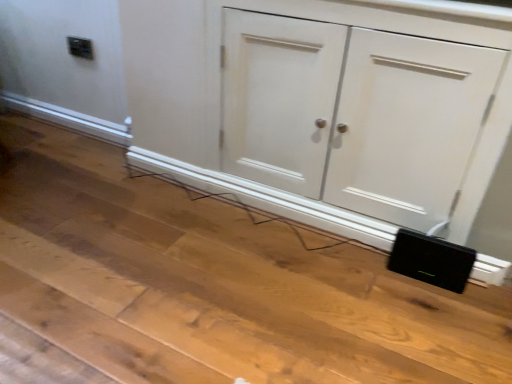
Question: Is white matte cupboard at lower right looking in the opposite direction of black matte speaker at lower right?

Choices:
 (A) yes
 (B) no

Answer: (B)

Question: Considering the relative sizes of white matte cupboard at lower right and black matte speaker at lower right in the image provided, is white matte cupboard at lower right thinner than black matte speaker at lower right?

Choices:
 (A) no
 (B) yes

Answer: (A)

Question: Does white matte cupboard at lower right have a smaller size compared to black matte speaker at lower right?

Choices:
 (A) yes
 (B) no

Answer: (B)

Question: From the image's perspective, is white matte cupboard at lower right on top of black matte speaker at lower right?

Choices:
 (A) no
 (B) yes

Answer: (B)

Question: Considering the relative sizes of white matte cupboard at lower right and black matte speaker at lower right in the image provided, is white matte cupboard at lower right taller than black matte speaker at lower right?

Choices:
 (A) yes
 (B) no

Answer: (A)

Question: From a real-world perspective, relative to black matte speaker at lower right, is white matte cupboard at lower right vertically above or below?

Choices:
 (A) above
 (B) below

Answer: (A)

Question: Based on their positions, is white matte cupboard at lower right located to the left or right of black matte speaker at lower right?

Choices:
 (A) right
 (B) left

Answer: (B)

Question: In terms of width, does white matte cupboard at lower right look wider or thinner when compared to black matte speaker at lower right?

Choices:
 (A) wide
 (B) thin

Answer: (A)

Question: In the image, is white matte cupboard at lower right positioned in front of or behind black matte speaker at lower right?

Choices:
 (A) front
 (B) behind

Answer: (A)

Question: Is black matte speaker at lower right bigger or smaller than black plastic electric outlet at upper left?

Choices:
 (A) small
 (B) big

Answer: (B)

Question: From the image's perspective, is black matte speaker at lower right located above or below black plastic electric outlet at upper left?

Choices:
 (A) above
 (B) below

Answer: (B)

Question: Would you say black matte speaker at lower right is inside or outside black plastic electric outlet at upper left?

Choices:
 (A) outside
 (B) inside

Answer: (A)

Question: From a real-world perspective, is black matte speaker at lower right positioned above or below black plastic electric outlet at upper left?

Choices:
 (A) above
 (B) below

Answer: (B)

Question: Is point (452, 261) closer or farther from the camera than point (175, 148)?

Choices:
 (A) farther
 (B) closer

Answer: (B)

Question: From the image's perspective, relative to white matte cupboard at lower right, is black matte speaker at lower right above or below?

Choices:
 (A) above
 (B) below

Answer: (B)